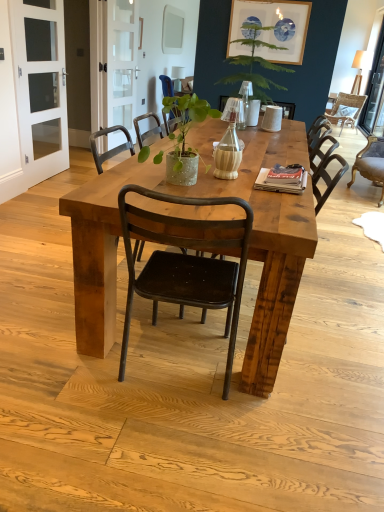
The width and height of the screenshot is (384, 512). I want to click on free point in front of translucent wood bottle at center, so click(233, 190).